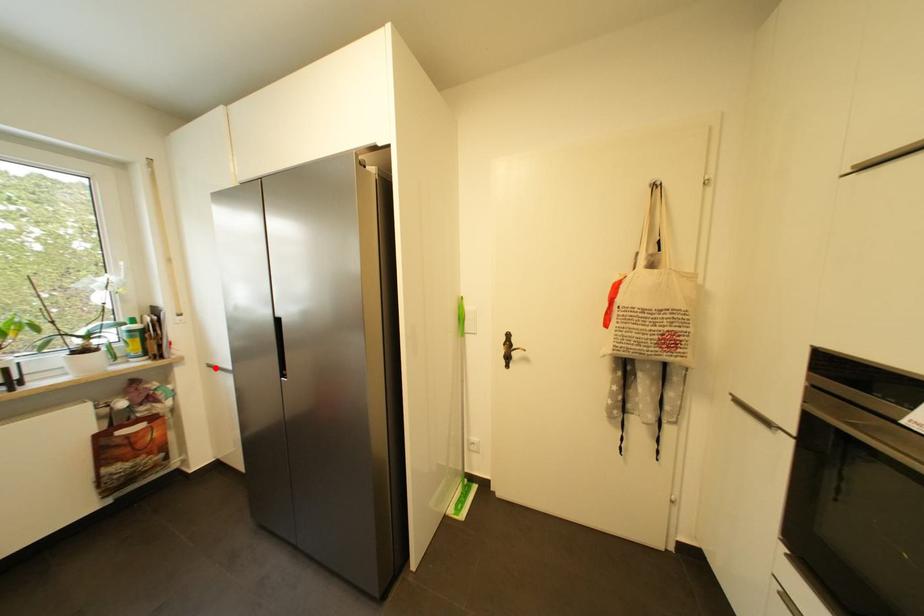
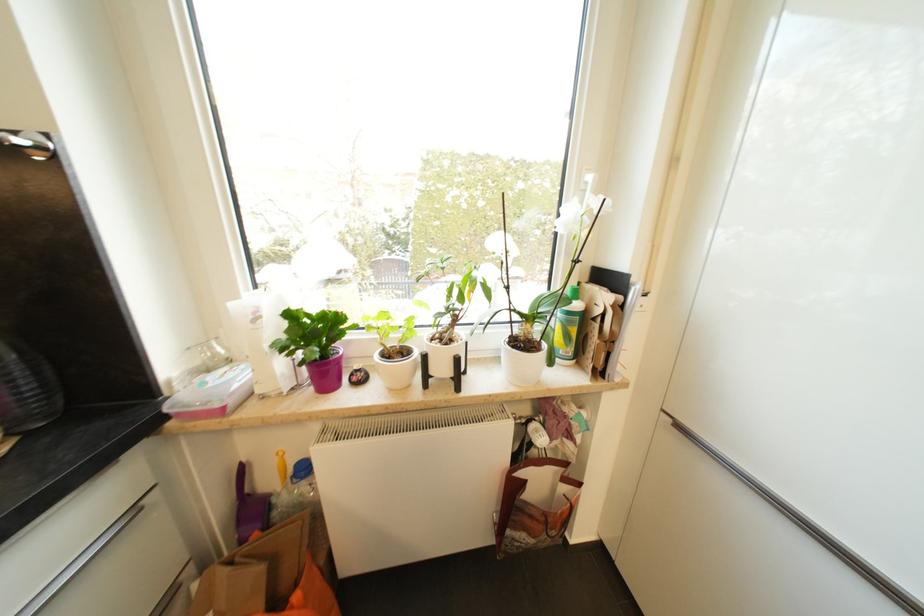
Question: I am providing you with two images of the same scene from different viewpoints. A red point is shown in image1. For the corresponding object point in image2, is it positioned nearer or farther from the camera?

Choices:
 (A) Nearer
 (B) Farther

Answer: (A)